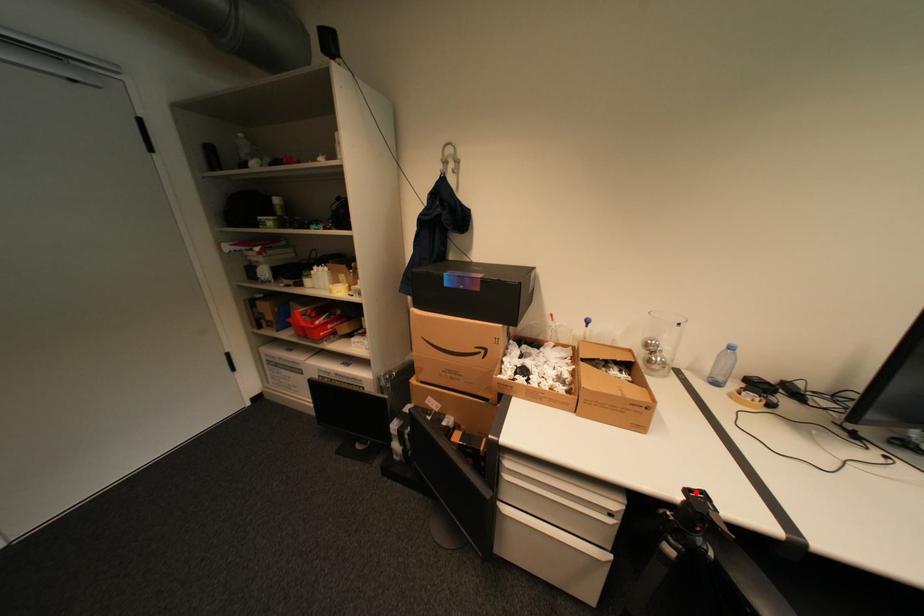
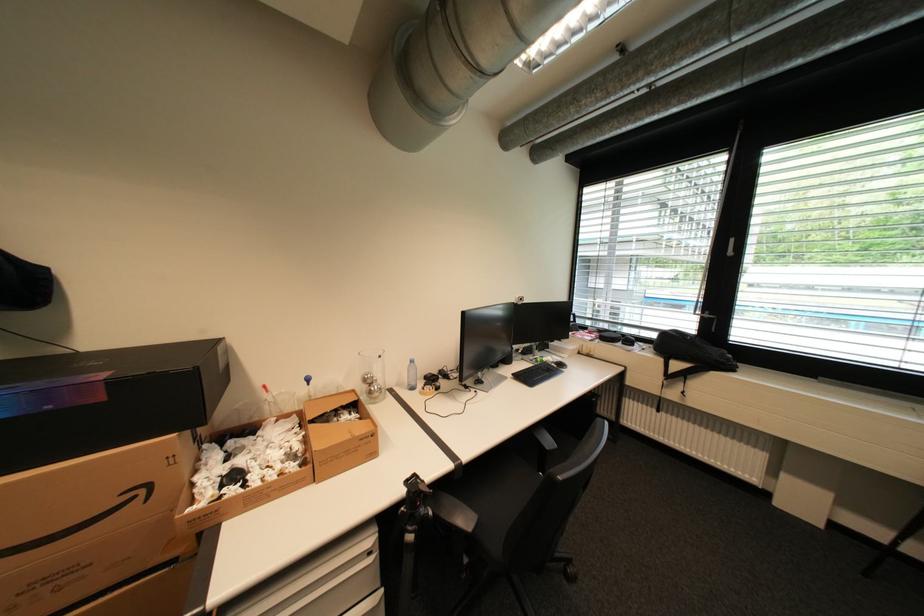
Locate, in the second image, the point that corresponds to the highlighted location in the first image.

(416, 484)